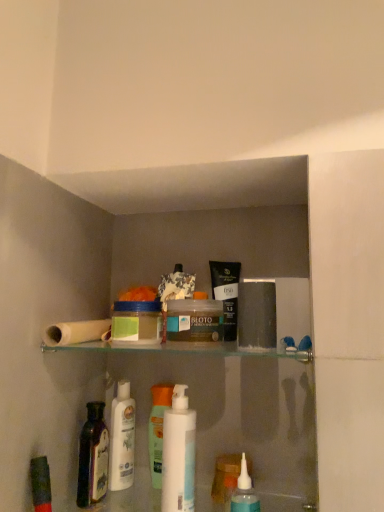
Question: Which direction should I rotate to look at white plastic bottle at center, marked as the first mouthwash in a bottom-to-top arrangement, — up or down?

Choices:
 (A) down
 (B) up

Answer: (A)

Question: From the image's perspective, does white matte toilet paper at upper left appear higher than translucent plastic jar at center, the 2th mouthwash from the bottom?

Choices:
 (A) no
 (B) yes

Answer: (A)

Question: From the image's perspective, would you say white matte toilet paper at upper left is shown under translucent plastic jar at center, the 2th mouthwash from the bottom?

Choices:
 (A) yes
 (B) no

Answer: (A)

Question: Is white matte toilet paper at upper left facing towards translucent plastic jar at center, which is the second mouthwash in top-to-bottom order?

Choices:
 (A) no
 (B) yes

Answer: (A)

Question: From a real-world perspective, is white matte toilet paper at upper left physically below translucent plastic jar at center, which is the second mouthwash in top-to-bottom order?

Choices:
 (A) yes
 (B) no

Answer: (A)

Question: Does white matte toilet paper at upper left have a lesser width compared to translucent plastic jar at center, which is the second mouthwash in top-to-bottom order?

Choices:
 (A) yes
 (B) no

Answer: (B)

Question: Can you confirm if white matte toilet paper at upper left is wider than translucent plastic jar at center, the 2th mouthwash from the bottom?

Choices:
 (A) yes
 (B) no

Answer: (A)

Question: From a real-world perspective, is white plastic bottle at center, placed as the third mouthwash when sorted from top to bottom, positioned over dark purple glass bottle at lower left based on gravity?

Choices:
 (A) yes
 (B) no

Answer: (A)

Question: Can you confirm if white plastic bottle at center, placed as the third mouthwash when sorted from top to bottom, is smaller than dark purple glass bottle at lower left?

Choices:
 (A) yes
 (B) no

Answer: (B)

Question: Could you tell me if white plastic bottle at center, placed as the third mouthwash when sorted from top to bottom, is turned towards dark purple glass bottle at lower left?

Choices:
 (A) no
 (B) yes

Answer: (A)

Question: Considering the relative sizes of white plastic bottle at center, marked as the first mouthwash in a bottom-to-top arrangement, and dark purple glass bottle at lower left in the image provided, is white plastic bottle at center, marked as the first mouthwash in a bottom-to-top arrangement, bigger than dark purple glass bottle at lower left?

Choices:
 (A) no
 (B) yes

Answer: (B)

Question: Is white plastic bottle at center, placed as the third mouthwash when sorted from top to bottom, not near dark purple glass bottle at lower left?

Choices:
 (A) no
 (B) yes

Answer: (A)

Question: Can you confirm if white plastic bottle at center, placed as the third mouthwash when sorted from top to bottom, is shorter than dark purple glass bottle at lower left?

Choices:
 (A) yes
 (B) no

Answer: (B)

Question: Does white plastic bottle at center, the first toiletry positioned from the left, have a smaller size compared to matte black tube at upper center, placed as the 1th toiletry when sorted from right to left?

Choices:
 (A) yes
 (B) no

Answer: (A)